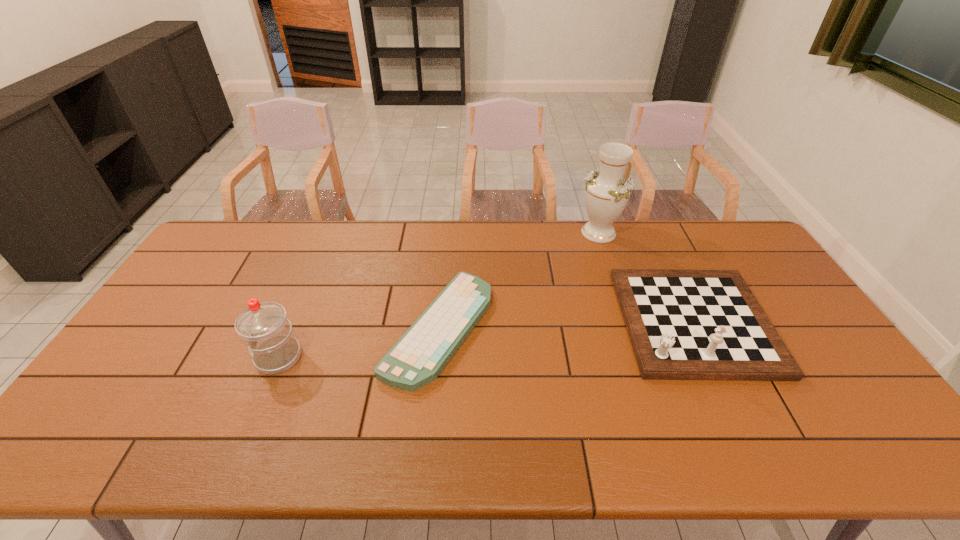
At what (x,y) coordinates should I click in order to perform the action: click on the tallest object. Please return your answer as a coordinate pair (x, y). This screenshot has height=540, width=960. Looking at the image, I should click on (607, 192).

At what (x,y) coordinates should I click in order to perform the action: click on vase. Please return your answer as a coordinate pair (x, y). This screenshot has width=960, height=540. Looking at the image, I should click on (607, 192).

The width and height of the screenshot is (960, 540). Find the location of `the third shortest object`. the third shortest object is located at coordinates (264, 326).

I want to click on water bottle, so click(264, 326).

Locate an element on the screen. The image size is (960, 540). the second shortest object is located at coordinates (683, 324).

Image resolution: width=960 pixels, height=540 pixels. What are the coordinates of `the shortest object` in the screenshot? It's located at (418, 357).

Locate an element on the screen. the second object from left to right is located at coordinates (418, 357).

The width and height of the screenshot is (960, 540). I want to click on vacant space located 0.380m on the front of the farthest object, so click(630, 327).

At what (x,y) coordinates should I click in order to perform the action: click on free space located 0.120m on the handle side of the third shortest object. Please return your answer as a coordinate pair (x, y). Looking at the image, I should click on (212, 357).

Identify the location of vacant space positioned on the handle side of the third shortest object. (190, 357).